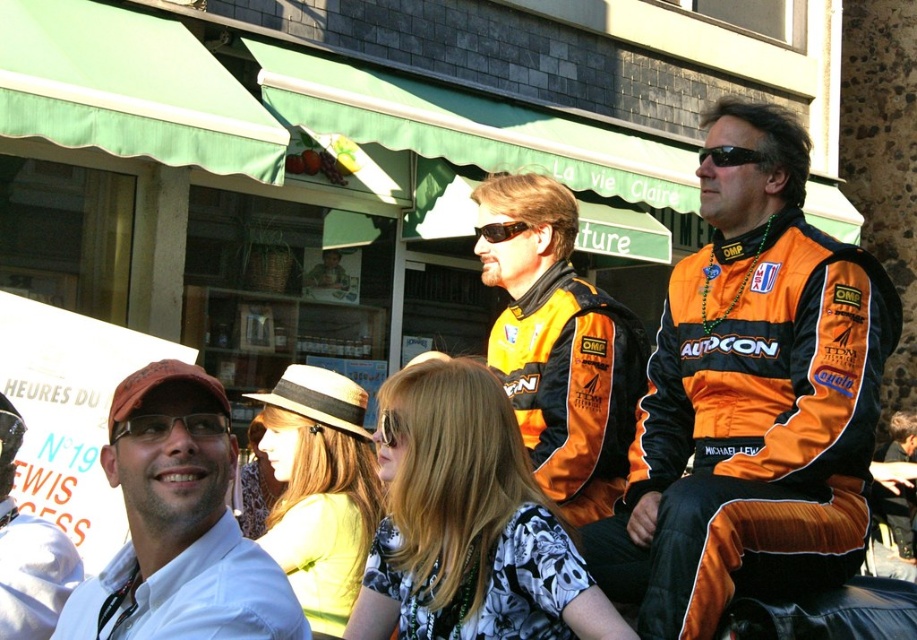
Which is more to the left, matte white shirt at center or orange fabric racing suit at center?

From the viewer's perspective, matte white shirt at center appears more on the left side.

Can you confirm if matte white shirt at center is shorter than orange fabric racing suit at center?

Yes, matte white shirt at center is shorter than orange fabric racing suit at center.

Find the location of a particular element. Image resolution: width=917 pixels, height=640 pixels. matte white shirt at center is located at coordinates (178, 524).

Describe the element at coordinates (750, 401) in the screenshot. I see `orange synthetic racing suit at right` at that location.

Between orange synthetic racing suit at right and black plastic sunglasses at upper center, which one has more height?

orange synthetic racing suit at right

Is point (768, 531) positioned before point (735, 163)?

That is True.

Identify the location of orange synthetic racing suit at right. pyautogui.click(x=750, y=401).

Between orange fabric racing suit at center and black plastic sunglasses at upper center, which one is positioned higher?

black plastic sunglasses at upper center is higher up.

Looking at this image, who is taller, orange fabric racing suit at center or black plastic sunglasses at upper center?

orange fabric racing suit at center is taller.

What do you see at coordinates (560, 348) in the screenshot? I see `orange fabric racing suit at center` at bounding box center [560, 348].

This screenshot has height=640, width=917. What are the coordinates of `orange fabric racing suit at center` in the screenshot? It's located at [x=560, y=348].